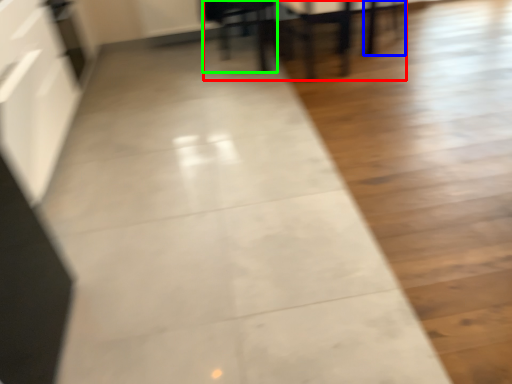
Question: Estimate the real-world distances between objects in this image. Which object is farther from table (highlighted by a red box), chair (highlighted by a blue box) or furniture (highlighted by a green box)?

Choices:
 (A) chair
 (B) furniture

Answer: (A)